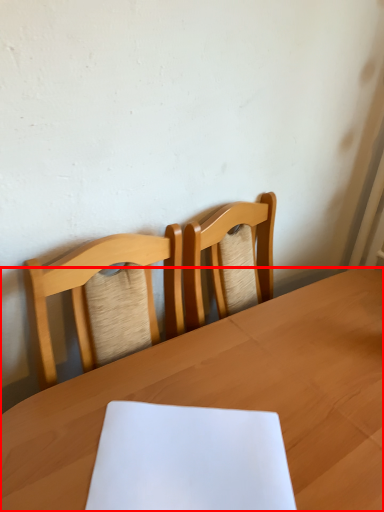
Question: From the image, what is the correct spatial relationship of table (annotated by the red box) in relation to notebook?

Choices:
 (A) right
 (B) left

Answer: (A)